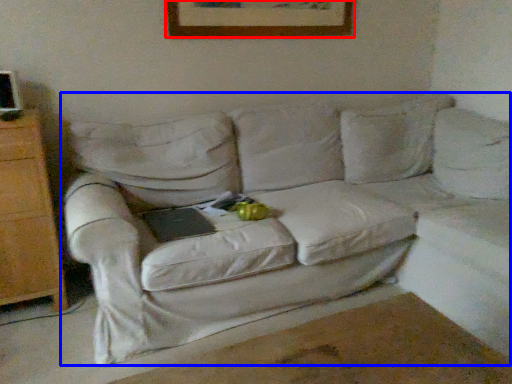
Question: Which of the following is the farthest to the observer, picture frame (highlighted by a red box) or studio couch (highlighted by a blue box)?

Choices:
 (A) picture frame
 (B) studio couch

Answer: (A)